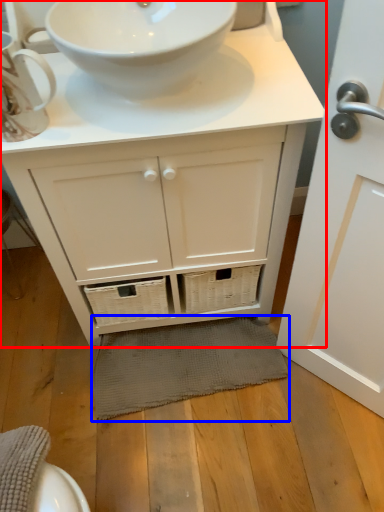
Question: Among these objects, which one is nearest to the camera, bathroom cabinet (highlighted by a red box) or bath mat (highlighted by a blue box)?

Choices:
 (A) bathroom cabinet
 (B) bath mat

Answer: (A)